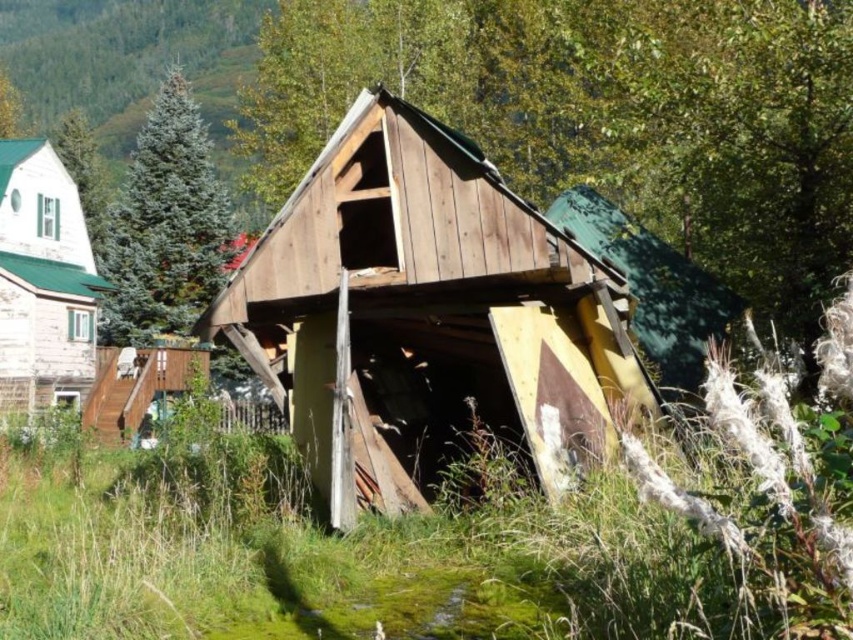
Is point (164, 116) farther from viewer compared to point (22, 156)?

Yes, it is.

Does point (151, 225) come closer to viewer compared to point (3, 186)?

No.

Does point (175, 264) lie behind point (3, 188)?

Yes, it is behind point (3, 188).

Where is `green fir tree at upper left`? green fir tree at upper left is located at coordinates (166, 225).

Who is positioned more to the left, wooden barn at center or green shingles cabin at left?

green shingles cabin at left

Between wooden barn at center and green shingles cabin at left, which one has more height?

Standing taller between the two is green shingles cabin at left.

Who is more forward, (625, 372) or (68, 346)?

Positioned in front is point (625, 372).

At what (x,y) coordinates should I click in order to perform the action: click on wooden barn at center. Please return your answer as a coordinate pair (x, y). Looking at the image, I should click on (424, 314).

Is point (271, 163) positioned after point (24, 310)?

Yes, point (271, 163) is farther from viewer.

What do you see at coordinates (602, 115) in the screenshot? I see `brown wood at center` at bounding box center [602, 115].

Where is `brown wood at center`? This screenshot has width=853, height=640. brown wood at center is located at coordinates (602, 115).